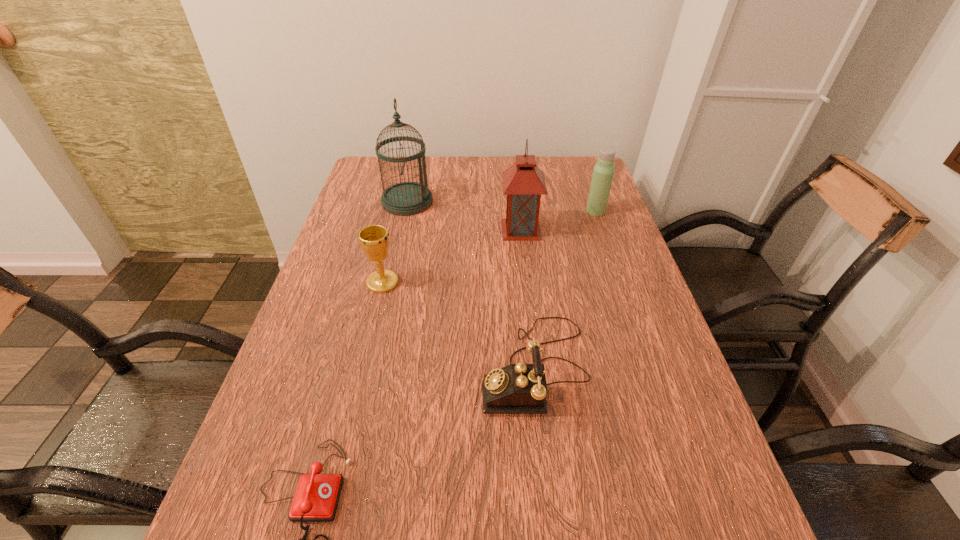
Locate an element on the screen. object that is at the far left corner is located at coordinates (408, 198).

Locate an element on the screen. The image size is (960, 540). vacant space at the far edge of the desktop is located at coordinates (501, 174).

This screenshot has width=960, height=540. Find the location of `free space at the left edge of the desktop`. free space at the left edge of the desktop is located at coordinates (338, 232).

Where is `free region at the right edge of the desktop`? free region at the right edge of the desktop is located at coordinates (602, 231).

The width and height of the screenshot is (960, 540). What are the coordinates of `vacant area that lies between the rightmost object and the farther telephone` in the screenshot? It's located at (565, 289).

Where is `vacant area that lies between the birdcage and the sixth shortest object`? vacant area that lies between the birdcage and the sixth shortest object is located at coordinates (464, 215).

Image resolution: width=960 pixels, height=540 pixels. Find the location of `empty space between the fifth farthest object and the chalice`. empty space between the fifth farthest object and the chalice is located at coordinates (459, 325).

This screenshot has height=540, width=960. Identify the location of vacant space that is in between the birdcage and the rightmost object. (501, 206).

This screenshot has height=540, width=960. In order to click on unoccupied area between the chalice and the third tallest object in this screenshot , I will do [490, 247].

Choose which object is the sixth nearest neighbor to the fifth shortest object. Please provide its 2D coordinates. Your answer should be formatted as a tuple, i.e. [(x, y)], where the tuple contains the x and y coordinates of a point satisfying the conditions above.

[(469, 539)]